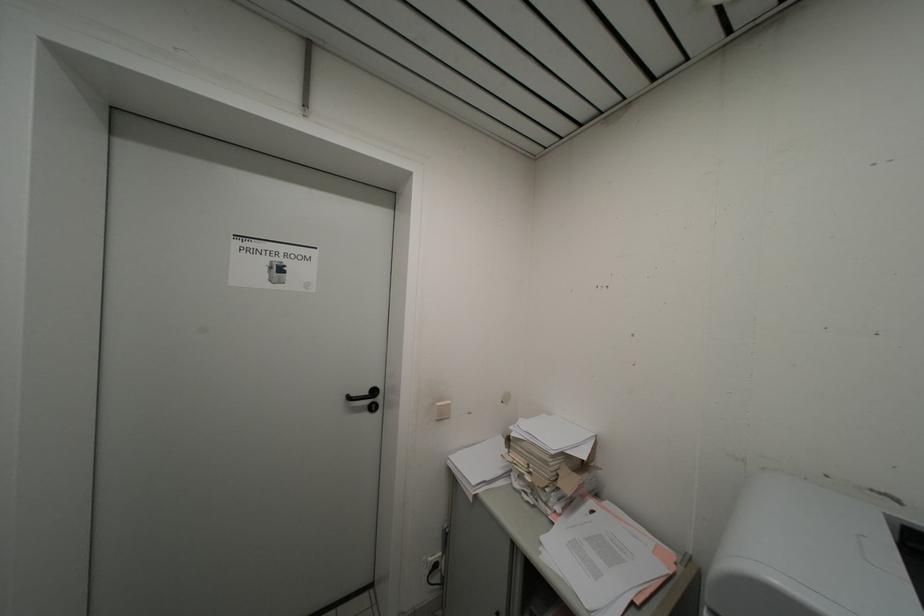
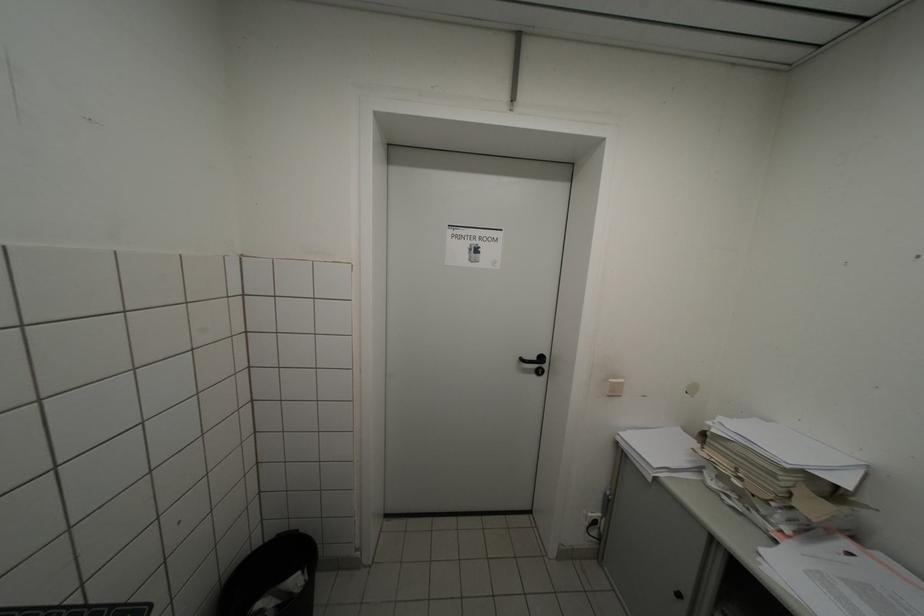
Where in the second image is the point corresponding to point 359,397 from the first image?

(532, 361)